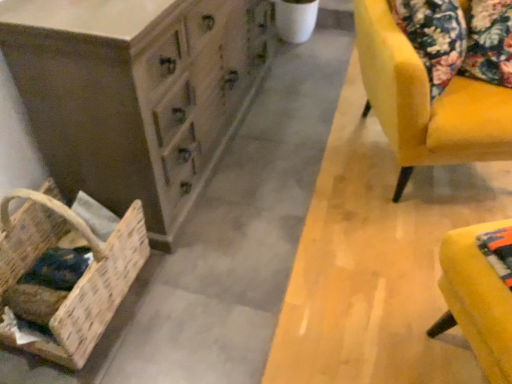
Identify the location of free location in front of wooden chest of drawers at lower left. This screenshot has width=512, height=384. (256, 270).